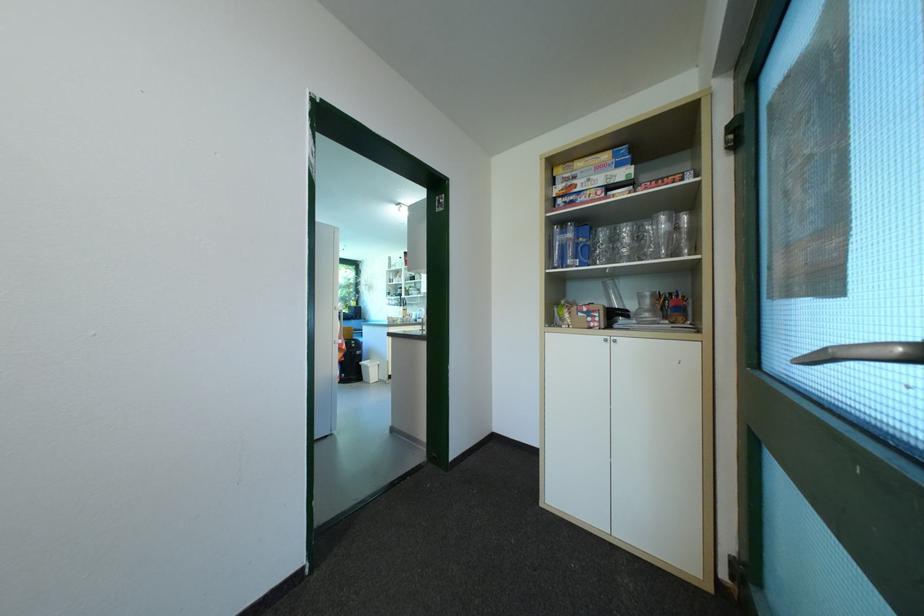
The width and height of the screenshot is (924, 616). What are the coordinates of `dark door handle` in the screenshot? It's located at (865, 353).